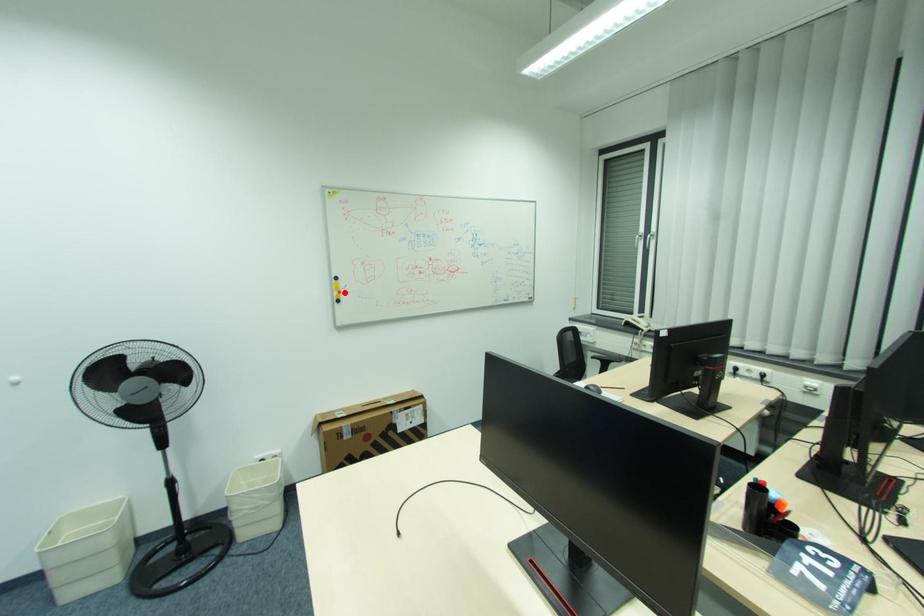
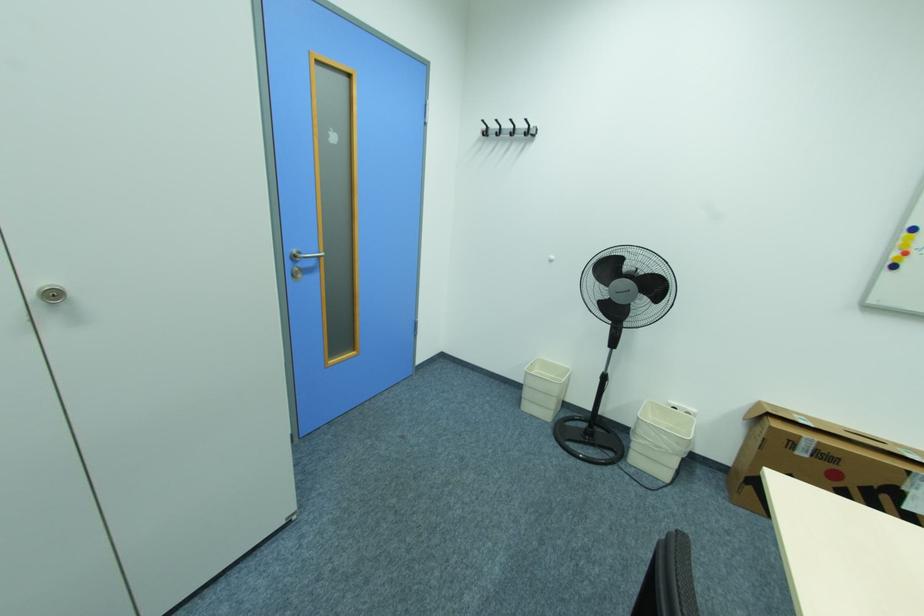
Question: I am providing you with two images of the same scene from different viewpoints. In image1, a red point is highlighted. Considering the same 3D point in image2, which of the following is correct?

Choices:
 (A) It is closer
 (B) It is farther

Answer: (B)